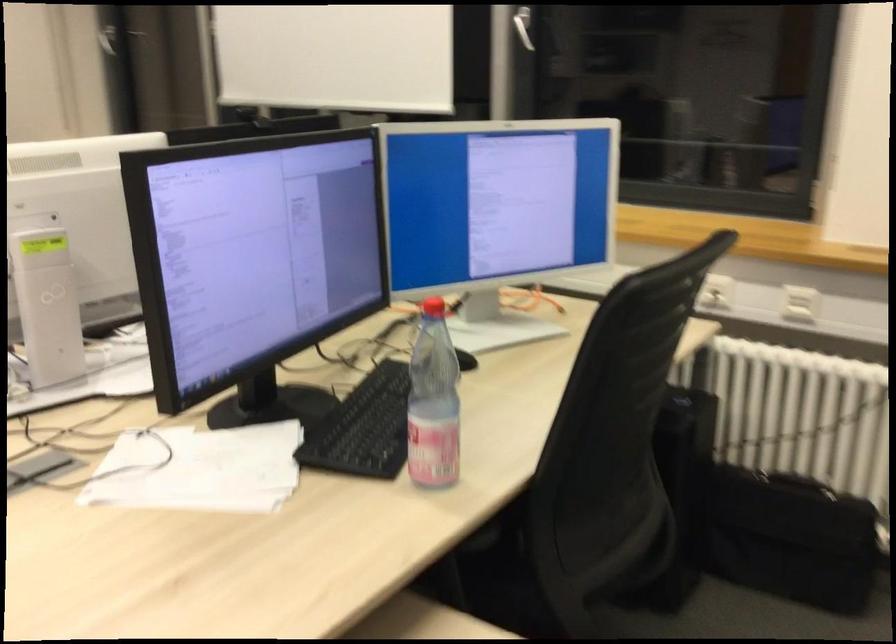
The height and width of the screenshot is (644, 896). Find the location of `white window handle`. white window handle is located at coordinates (112, 33).